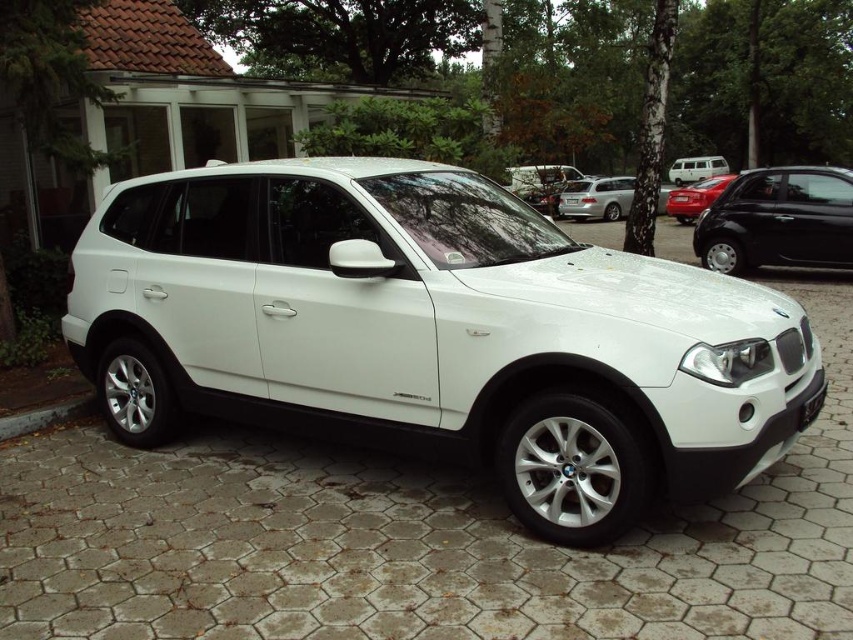
You are a delivery driver who needs to park your vehicle between the shiny black car at right and the white matte van at upper center. The parking space between them is exactly 77.14 feet long. Your delivery van is 22 feet long. Is there enough space to park your van between them without overlapping either vehicle?

The distance between the shiny black car at right and the white matte van at upper center is 77.14 feet. Since your van is only 22 feet long, there is ample space to park between them without overlapping either vehicle.

You are a delivery driver who needs to park your vehicle between the shiny red car at center and the white matte van at upper center. Considering their heights, which vehicle should you park closer to to ensure your delivery truck, which is 2 meters tall, can pass through the space without hitting the roof?

The shiny red car at center is taller than the white matte van at upper center. To ensure your delivery truck, which is 2 meters tall, can pass through, you should park closer to the white matte van at upper center since it has a lower height, providing more clearance for the truck.

You are standing at the origin point of the image coordinate system. You want to walk to the shiny red car at center. Which direction should you move in?

Since the shiny red car at center is located at coordinates point (x=695, y=196), you should move towards the upper right direction from your current position at the origin to reach it.